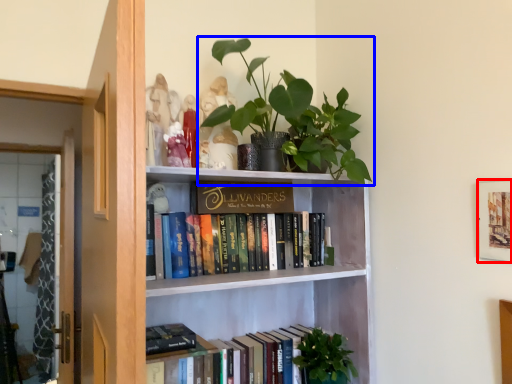
Question: Which object appears closest to the camera in this image, picture frame (highlighted by a red box) or houseplant (highlighted by a blue box)?

Choices:
 (A) picture frame
 (B) houseplant

Answer: (A)